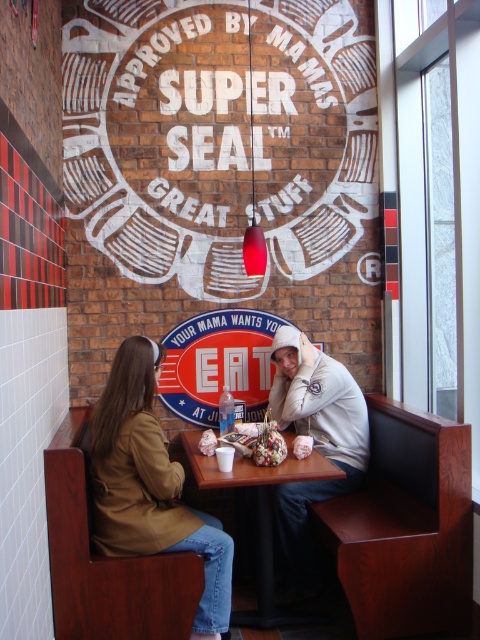
You are a customer entering the restaurant and see the brown leather jacket at lower left and the black plastic table at center. Which object is taller?

The brown leather jacket at lower left is taller than the black plastic table at center.

From the picture: What is located at point (151, 484) in the image?

A brown leather jacket at lower left is located at point (151, 484).